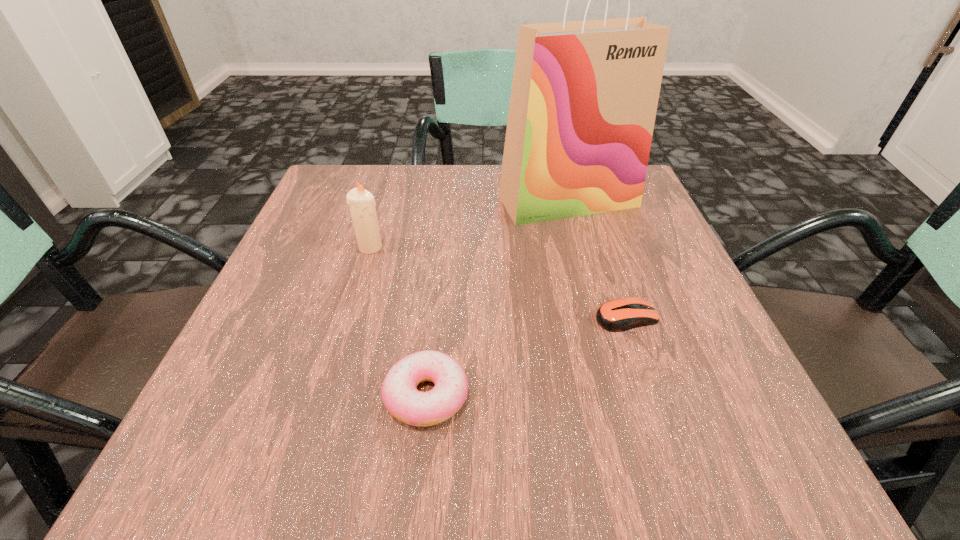
At what (x,y) coordinates should I click in order to perform the action: click on free spot located 0.110m on the back of the nearest object. Please return your answer as a coordinate pair (x, y). This screenshot has width=960, height=540. Looking at the image, I should click on (436, 309).

In order to click on free space located 0.210m on the front of the third farthest object in this screenshot , I will do `click(674, 461)`.

Where is `object located at the far edge`? The height and width of the screenshot is (540, 960). object located at the far edge is located at coordinates (584, 97).

The image size is (960, 540). I want to click on object at the near edge, so click(x=399, y=394).

Locate an element on the screen. This screenshot has height=540, width=960. object present at the left edge is located at coordinates (361, 202).

Where is `shopping bag that is at the right edge`? shopping bag that is at the right edge is located at coordinates (584, 97).

Locate an element on the screen. Image resolution: width=960 pixels, height=540 pixels. computer mouse located in the right edge section of the desktop is located at coordinates (618, 315).

In order to click on object that is at the far right corner in this screenshot , I will do `click(584, 97)`.

At what (x,y) coordinates should I click in order to perform the action: click on blank space at the far edge. Please return your answer as a coordinate pair (x, y). Image resolution: width=960 pixels, height=540 pixels. Looking at the image, I should click on (409, 207).

Where is `vacant space at the near edge of the desktop`? The width and height of the screenshot is (960, 540). vacant space at the near edge of the desktop is located at coordinates (610, 432).